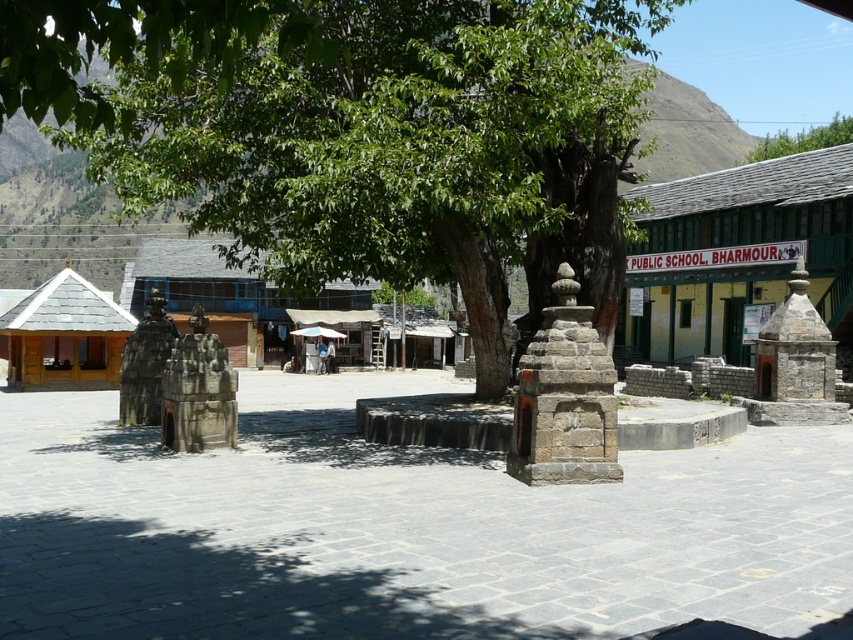
You are planning to set up a picnic blanket in the shaded area of the green leafy tree at center or the green leafy tree at upper right. Which tree would provide a larger shaded area for your picnic?

The green leafy tree at center might be wider than green leafy tree at upper right, so it would likely provide a larger shaded area for your picnic.

You are a visitor in this village and want to take a photo of the gray stone stupa at center and the green leafy tree at upper right. Which object should you focus on first if you want to include both in your photo without moving the camera?

You should focus on the gray stone stupa at center first because it is smaller in size compared to the green leafy tree at upper right, so capturing the smaller object first ensures both can fit in the frame.

Based on the coordinates provided, which object in the scene is located at point (403,147)?

The point (403,147) corresponds to the green leafy tree at center.